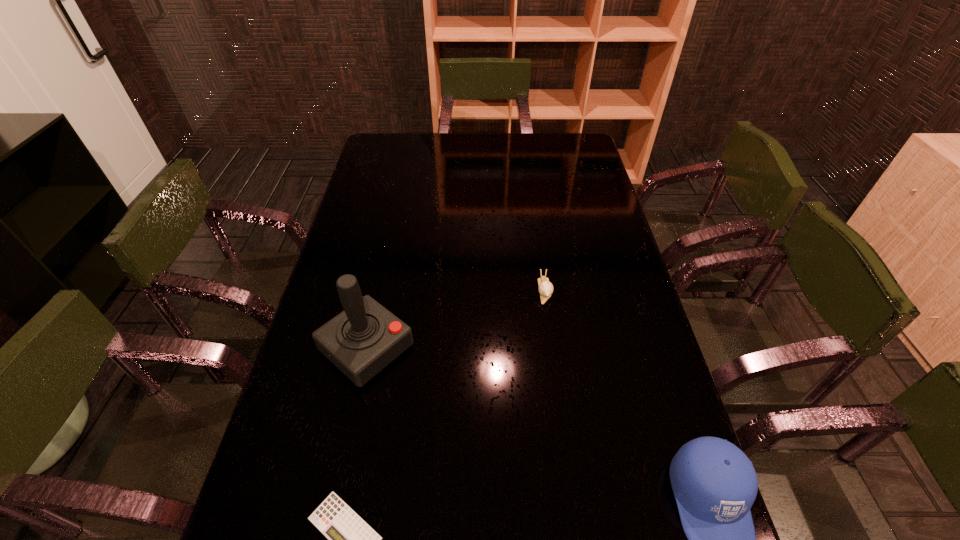
The image size is (960, 540). What are the coordinates of `object situated at the left edge` in the screenshot? It's located at (363, 339).

Locate an element on the screen. This screenshot has width=960, height=540. free spot at the far edge of the desktop is located at coordinates (416, 152).

Identify the location of vacant space at the near edge of the desktop. (515, 492).

In the image, there is a desktop. Where is `free space at the left edge`? The width and height of the screenshot is (960, 540). free space at the left edge is located at coordinates (340, 413).

Image resolution: width=960 pixels, height=540 pixels. In the image, there is a desktop. Find the location of `vacant space at the right edge`. vacant space at the right edge is located at coordinates (622, 248).

In the image, there is a desktop. Where is `vacant space at the far right corner`? The width and height of the screenshot is (960, 540). vacant space at the far right corner is located at coordinates (564, 147).

This screenshot has width=960, height=540. I want to click on vacant area that lies between the third nearest object and the second object from right to left, so click(456, 320).

Point out which object is positioned as the second nearest to the tallest object. Please provide its 2D coordinates. Your answer should be formatted as a tuple, i.e. [(x, y)], where the tuple contains the x and y coordinates of a point satisfying the conditions above.

[(545, 288)]

Identify which object is located as the second nearest to the third shortest object. Please provide its 2D coordinates. Your answer should be formatted as a tuple, i.e. [(x, y)], where the tuple contains the x and y coordinates of a point satisfying the conditions above.

[(350, 539)]

Locate an element on the screen. The height and width of the screenshot is (540, 960). free space that satisfies the following two spatial constraints: 1. on the back side of the joystick; 2. on the left side of the third tallest object is located at coordinates (379, 291).